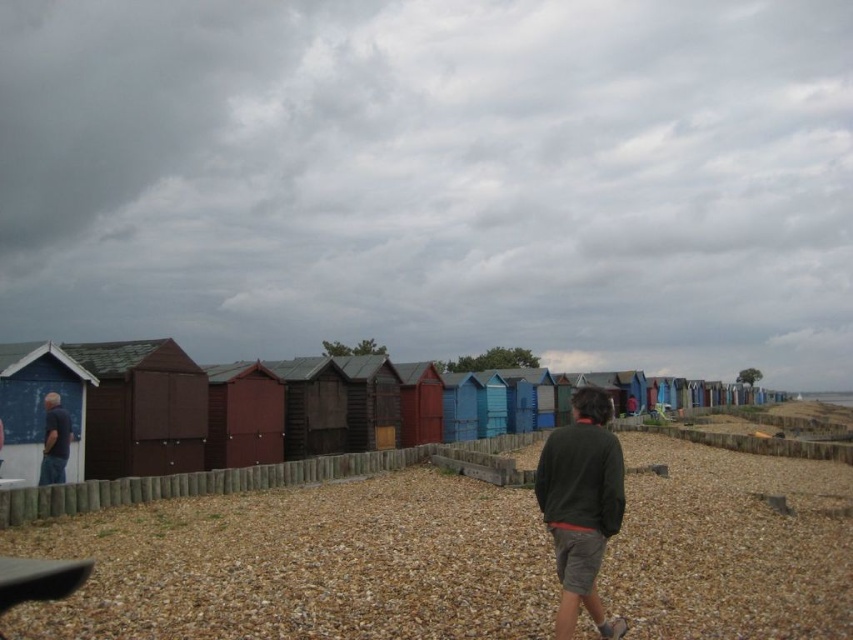
Question: Is brown wooden beach huts at left positioned before matte blue shirt at left?

Choices:
 (A) yes
 (B) no

Answer: (A)

Question: Is brown wooden beach huts at left bigger than dark green sweater at center?

Choices:
 (A) no
 (B) yes

Answer: (B)

Question: Does brown wooden beach huts at left appear under matte blue shirt at left?

Choices:
 (A) yes
 (B) no

Answer: (A)

Question: Among these objects, which one is nearest to the camera?

Choices:
 (A) cloudy sky at upper center
 (B) dark green sweater at center

Answer: (B)

Question: Which of the following is the farthest from the observer?

Choices:
 (A) (136, 45)
 (B) (585, 403)
 (C) (57, 440)
 (D) (440, 586)

Answer: (A)

Question: Which point appears closest to the camera in this image?

Choices:
 (A) (49, 442)
 (B) (578, 419)
 (C) (671, 499)
 (D) (207, 74)

Answer: (B)